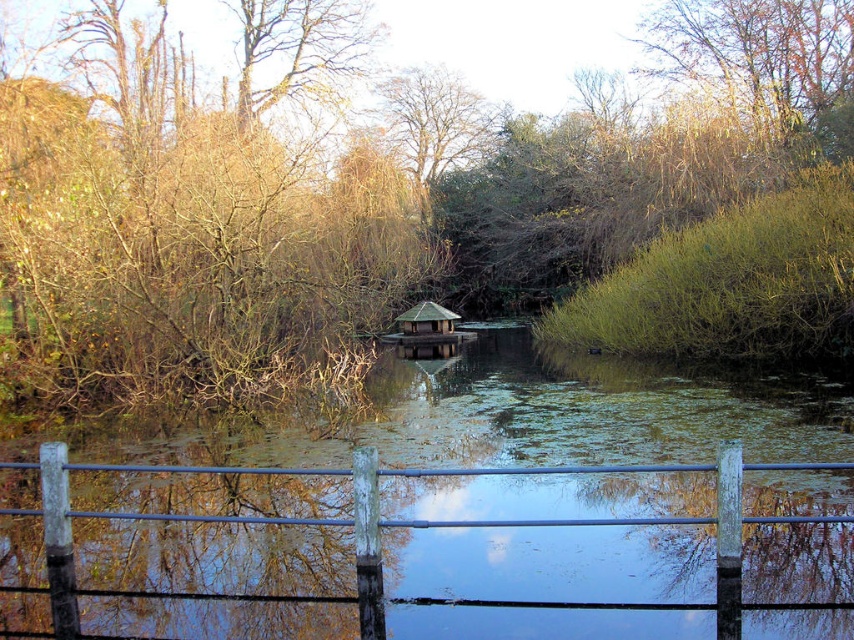
You are standing at the edge of the pond and see the brown leafless tree at center and the brown leafy tree at upper center. Which tree would cast a longer shadow on the water surface?

The brown leafless tree at center is taller than the brown leafy tree at upper center, so it would cast a longer shadow on the water surface.

You are standing at the edge of the pond and notice two points marked on the water surface. The first point is at coordinate point (x=241, y=468) and the second is at point (x=683, y=29). If you want to reach the point that is closer to you, which coordinate should you head towards?

You should head towards point (x=241, y=468) because it is in front of point (x=683, y=29), meaning it is closer to your current position at the edge of the pond.

You are standing at the edge of the pond and notice two trees in the scene. The first is a brown leafless tree at center, and the second is a brown leafy tree at upper center. Which tree appears bigger in size?

The brown leafless tree at center is larger in size compared to the brown leafy tree at upper center.